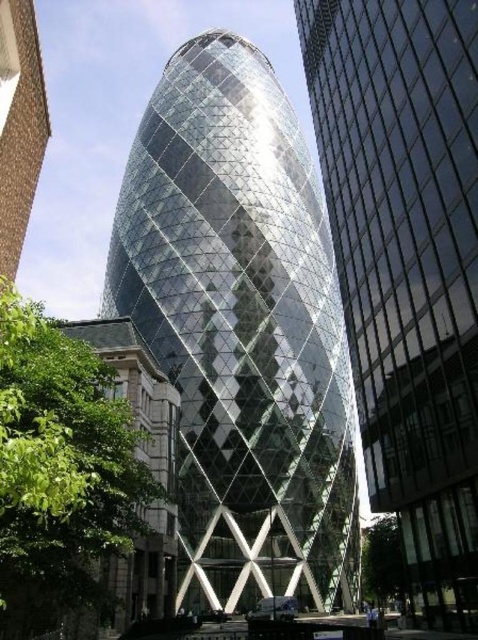
Does transparent glass tower at center appear over green leafy tree at lower right?

Indeed, transparent glass tower at center is positioned over green leafy tree at lower right.

Is transparent glass tower at center smaller than green leafy tree at lower right?

Incorrect, transparent glass tower at center is not smaller in size than green leafy tree at lower right.

Is point (180, 419) behind point (364, 550)?

No, (180, 419) is in front of (364, 550).

At what (x,y) coordinates should I click in order to perform the action: click on transparent glass tower at center. Please return your answer as a coordinate pair (x, y). This screenshot has height=640, width=478. Looking at the image, I should click on (241, 330).

Locate an element on the screen. This screenshot has width=478, height=640. green leafy tree at lower left is located at coordinates (62, 461).

Does green leafy tree at lower left appear on the right side of green leafy tree at lower right?

No, green leafy tree at lower left is not to the right of green leafy tree at lower right.

The height and width of the screenshot is (640, 478). Describe the element at coordinates (62, 461) in the screenshot. I see `green leafy tree at lower left` at that location.

The height and width of the screenshot is (640, 478). What are the coordinates of `green leafy tree at lower left` in the screenshot? It's located at (62, 461).

Does point (345, 104) lie behind point (377, 596)?

No, (345, 104) is in front of (377, 596).

Is transparent glass skyscraper at center taller than green leafy tree at lower right?

Yes.

The image size is (478, 640). Identify the location of transparent glass skyscraper at center. (408, 266).